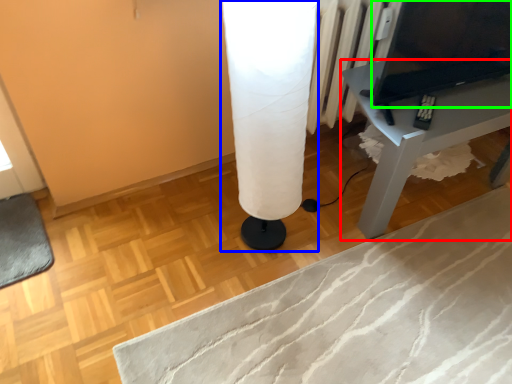
Question: Which object is positioned closest to table (highlighted by a red box)? Select from table lamp (highlighted by a blue box) and computer (highlighted by a green box).

Choices:
 (A) table lamp
 (B) computer

Answer: (B)